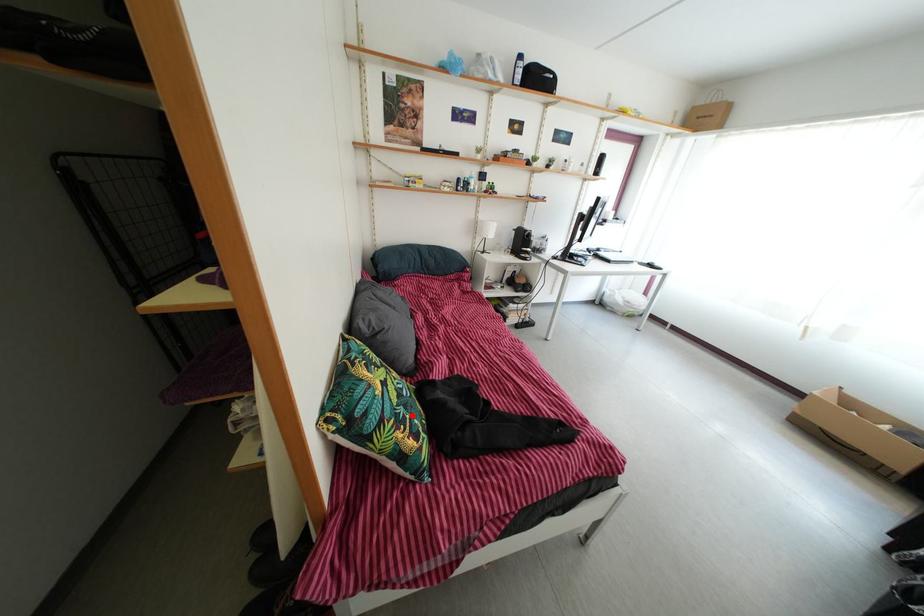
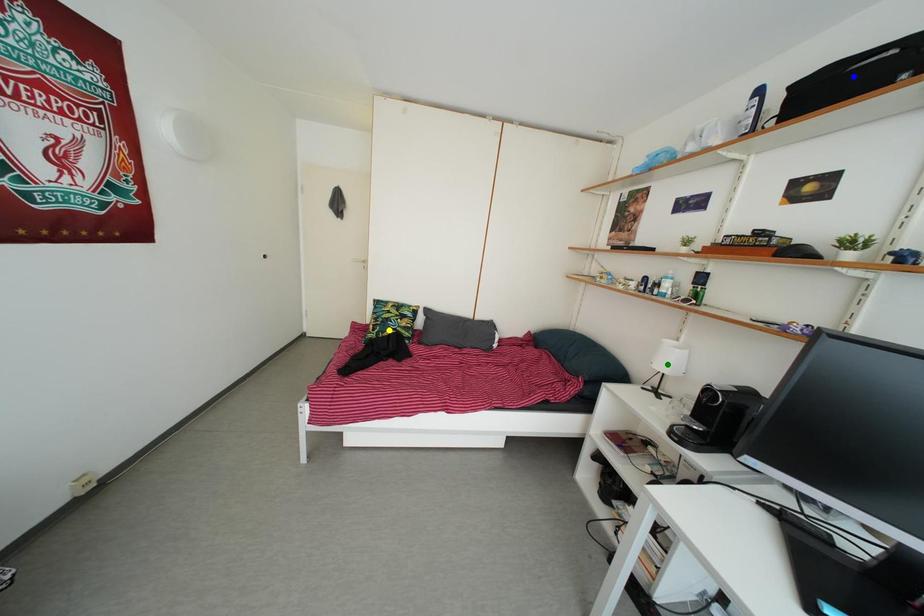
Question: I am providing you with two images of the same scene from different viewpoints. A red point is marked on the first image. You are given multiple points on the second image. Which spot in image 2 lines up with the point in image 1?

Choices:
 (A) blue point
 (B) green point
 (C) yellow point

Answer: (C)